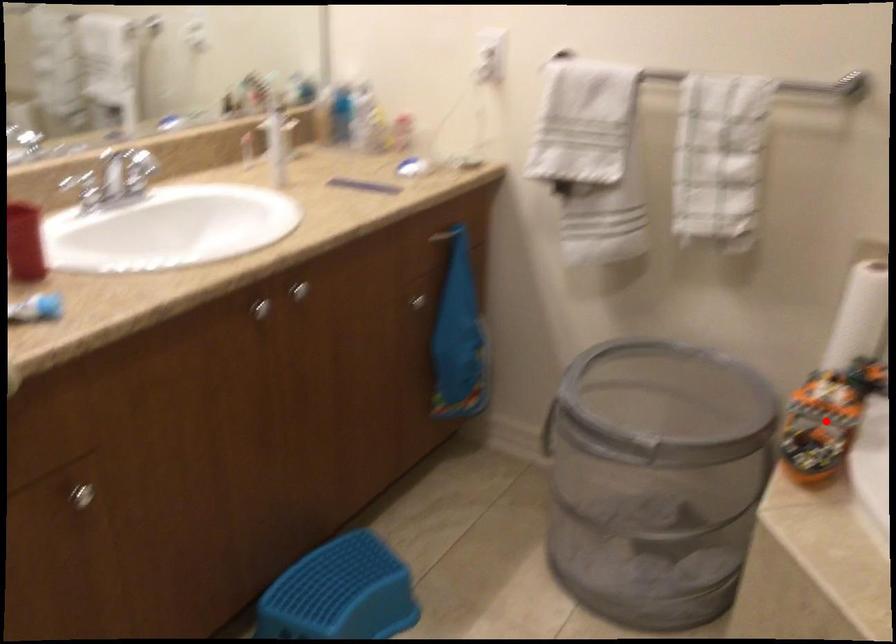
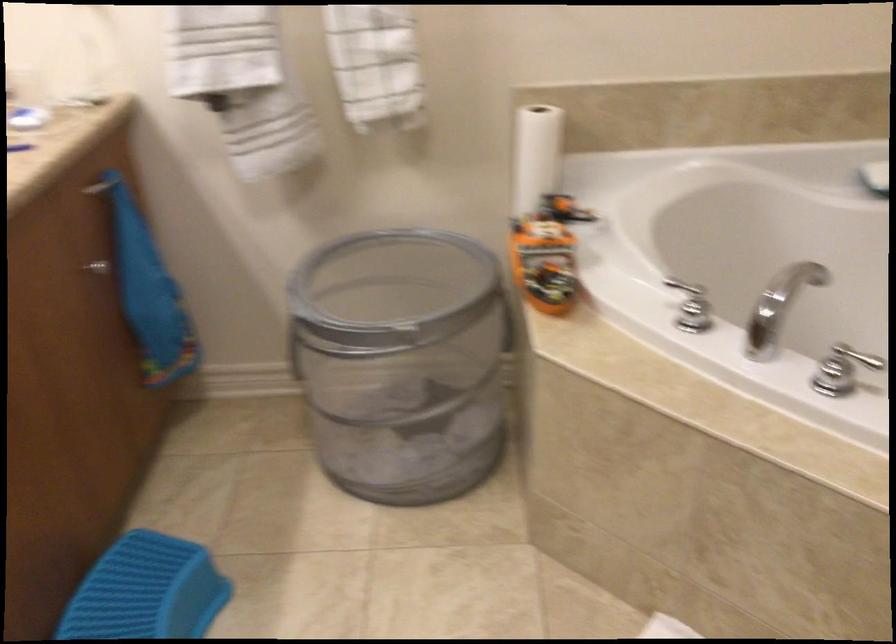
In the second image, find the point that corresponds to the highlighted location in the first image.

(547, 252)